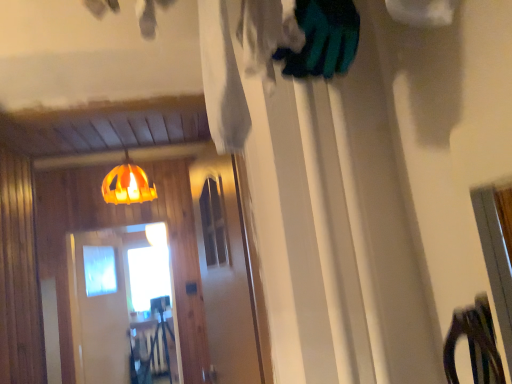
Question: From the image's perspective, would you say transparent plastic screen door at center, the second screen door positioned from the right, is shown under orange fabric lampshade at upper center?

Choices:
 (A) no
 (B) yes

Answer: (B)

Question: Can you confirm if transparent plastic screen door at center, the second screen door positioned from the right, is positioned to the left of orange fabric lampshade at upper center?

Choices:
 (A) no
 (B) yes

Answer: (B)

Question: Can you confirm if transparent plastic screen door at center, which is counted as the 1th screen door, starting from the left, is smaller than orange fabric lampshade at upper center?

Choices:
 (A) no
 (B) yes

Answer: (A)

Question: From a real-world perspective, does transparent plastic screen door at center, which is counted as the 1th screen door, starting from the left, stand above orange fabric lampshade at upper center?

Choices:
 (A) yes
 (B) no

Answer: (B)

Question: Is transparent plastic screen door at center, the second screen door positioned from the right, behind orange fabric lampshade at upper center?

Choices:
 (A) no
 (B) yes

Answer: (B)

Question: Is transparent plastic screen door at center, the second screen door positioned from the right, shorter than orange fabric lampshade at upper center?

Choices:
 (A) yes
 (B) no

Answer: (B)

Question: Is orange fabric lampshade at upper center in front of transparent glass screen door at center, the first screen door in the right-to-left sequence?

Choices:
 (A) no
 (B) yes

Answer: (A)

Question: Is orange fabric lampshade at upper center wider than transparent glass screen door at center, which is counted as the 2th screen door, starting from the back?

Choices:
 (A) yes
 (B) no

Answer: (A)

Question: Could you tell me if orange fabric lampshade at upper center is turned towards transparent glass screen door at center, positioned as the 1th screen door in front-to-back order?

Choices:
 (A) yes
 (B) no

Answer: (B)

Question: Does orange fabric lampshade at upper center touch transparent glass screen door at center, which is counted as the 2th screen door, starting from the back?

Choices:
 (A) no
 (B) yes

Answer: (A)

Question: Is orange fabric lampshade at upper center outside transparent glass screen door at center, the first screen door in the right-to-left sequence?

Choices:
 (A) no
 (B) yes

Answer: (B)

Question: From the image's perspective, would you say orange fabric lampshade at upper center is shown under transparent glass screen door at center, acting as the second screen door starting from the left?

Choices:
 (A) yes
 (B) no

Answer: (B)

Question: Is transparent glass screen door at center, acting as the second screen door starting from the left, aimed at transparent plastic screen door at center, the 1th screen door positioned from the back?

Choices:
 (A) no
 (B) yes

Answer: (A)